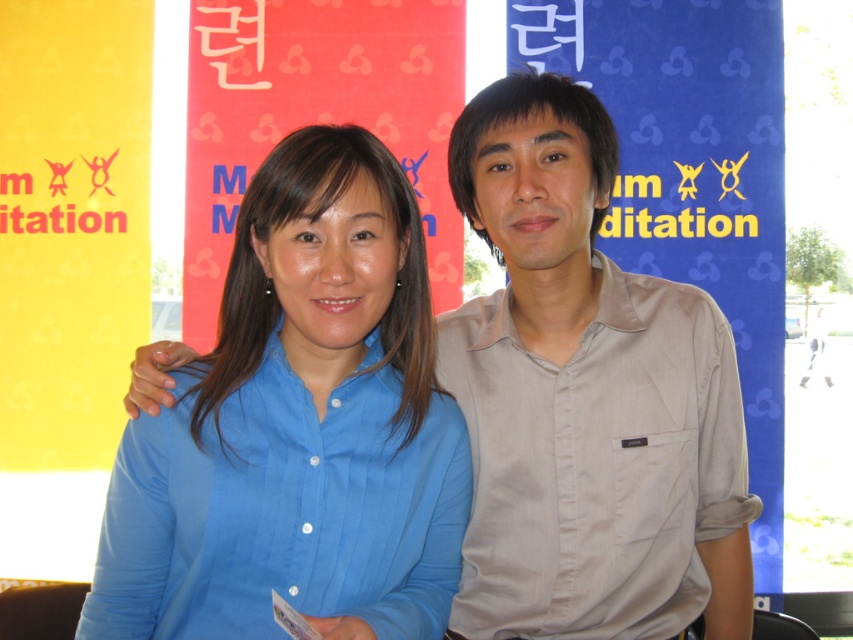
Can you confirm if blue smooth shirt at center is shorter than beige cotton shirt at right?

No, blue smooth shirt at center is not shorter than beige cotton shirt at right.

Can you confirm if blue smooth shirt at center is taller than beige cotton shirt at right?

Yes.

Does point (369, 253) lie in front of point (448, 388)?

That is True.

The image size is (853, 640). Identify the location of blue smooth shirt at center. coord(299,428).

Is point (164, 577) positioned before point (641, 436)?

Yes.

Is blue smooth shirt at center bigger than matte beige shirt at center?

No, blue smooth shirt at center is not bigger than matte beige shirt at center.

Which is behind, point (368, 397) or point (517, 486)?

Positioned behind is point (517, 486).

I want to click on blue smooth shirt at center, so click(x=299, y=428).

Is point (712, 566) farther from camera compared to point (706, 602)?

That is True.

Does matte beige shirt at center have a greater width compared to beige cotton shirt at right?

Incorrect, matte beige shirt at center's width does not surpass beige cotton shirt at right's.

You are a GUI agent. You are given a task and a screenshot of the screen. Output one action in this format:
    pyautogui.click(x=<x>, y=<y>)
    Task: Click on the matte beige shirt at center
    
    Given the screenshot: What is the action you would take?
    pyautogui.click(x=585, y=397)

Find the location of a particular element. This screenshot has width=853, height=640. matte beige shirt at center is located at coordinates (585, 397).